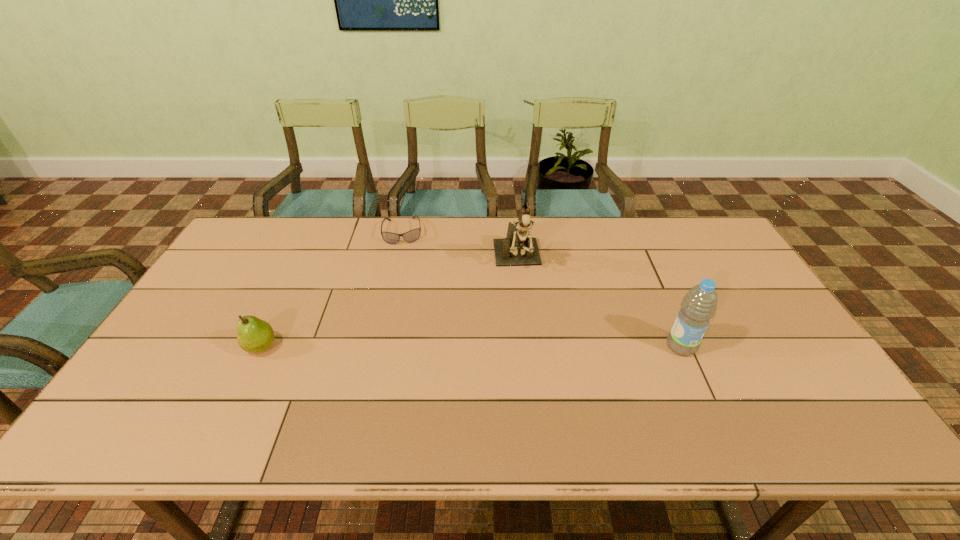
Identify the location of the third tallest object. This screenshot has height=540, width=960. (254, 335).

Identify the location of the leftmost object. (254, 335).

What are the coordinates of `water bottle` in the screenshot? It's located at (699, 305).

The image size is (960, 540). What are the coordinates of `the rightmost object` in the screenshot? It's located at (699, 305).

In order to click on the shortest object in this screenshot , I will do `click(411, 236)`.

At what (x,y) coordinates should I click in order to perform the action: click on the second object from left to right. Please return your answer as a coordinate pair (x, y). Looking at the image, I should click on (411, 236).

At what (x,y) coordinates should I click in order to perform the action: click on the second object from right to left. Please return your answer as a coordinate pair (x, y). The height and width of the screenshot is (540, 960). Looking at the image, I should click on (517, 249).

The width and height of the screenshot is (960, 540). Find the location of `the tallest object`. the tallest object is located at coordinates (517, 249).

Where is `vacant space located on the front of the leftmost object`? This screenshot has height=540, width=960. vacant space located on the front of the leftmost object is located at coordinates (244, 382).

Where is `vacant region located 0.280m on the back of the water bottle`? Image resolution: width=960 pixels, height=540 pixels. vacant region located 0.280m on the back of the water bottle is located at coordinates (647, 269).